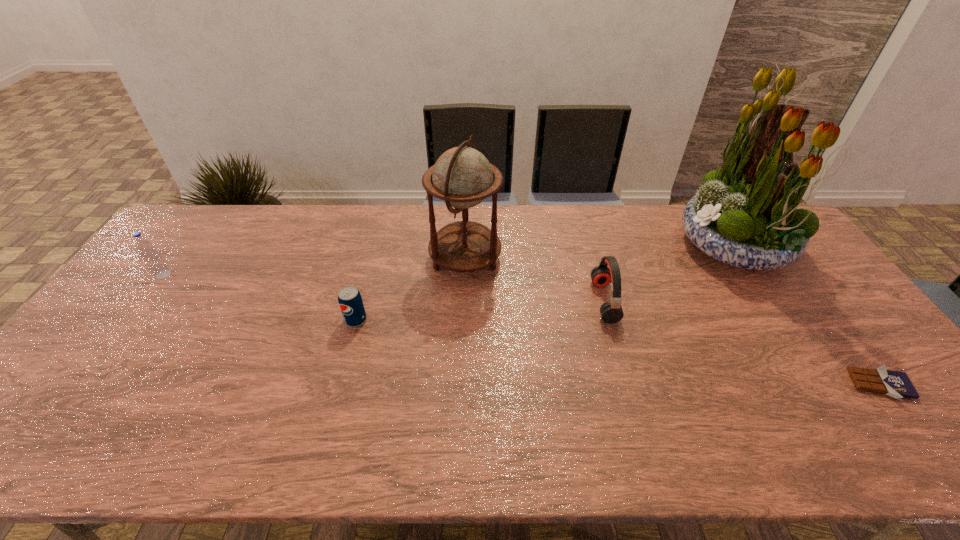
Locate an element on the screen. Image resolution: width=960 pixels, height=540 pixels. globe located at the far edge is located at coordinates (462, 177).

Locate an element on the screen. This screenshot has width=960, height=540. object that is positioned at the left edge is located at coordinates (152, 258).

At what (x,y) coordinates should I click in order to perform the action: click on flower arrangement present at the right edge. Please return your answer as a coordinate pair (x, y). Looking at the image, I should click on click(746, 215).

You are a GUI agent. You are given a task and a screenshot of the screen. Output one action in this format:
    pyautogui.click(x=<x>, y=<y>)
    Task: Click on the chocolate bar at the right edge
    The width and height of the screenshot is (960, 540).
    Given the screenshot: What is the action you would take?
    pyautogui.click(x=896, y=384)

The height and width of the screenshot is (540, 960). I want to click on object that is at the far right corner, so click(x=746, y=215).

Image resolution: width=960 pixels, height=540 pixels. I want to click on free region at the far edge, so [x=344, y=211].

In the image, there is a desktop. Where is `vacant space at the near edge`? vacant space at the near edge is located at coordinates (507, 458).

At what (x,y) coordinates should I click in order to perform the action: click on free space at the left edge. Please return your answer as a coordinate pair (x, y). Image resolution: width=960 pixels, height=540 pixels. Looking at the image, I should click on (191, 250).

The width and height of the screenshot is (960, 540). Identify the location of free space at the right edge. (869, 395).

You are a GUI agent. You are given a task and a screenshot of the screen. Output one action in this format:
    pyautogui.click(x=<x>, y=<y>)
    Task: Click on the blank area at the near right corner
    
    Given the screenshot: What is the action you would take?
    pyautogui.click(x=880, y=431)